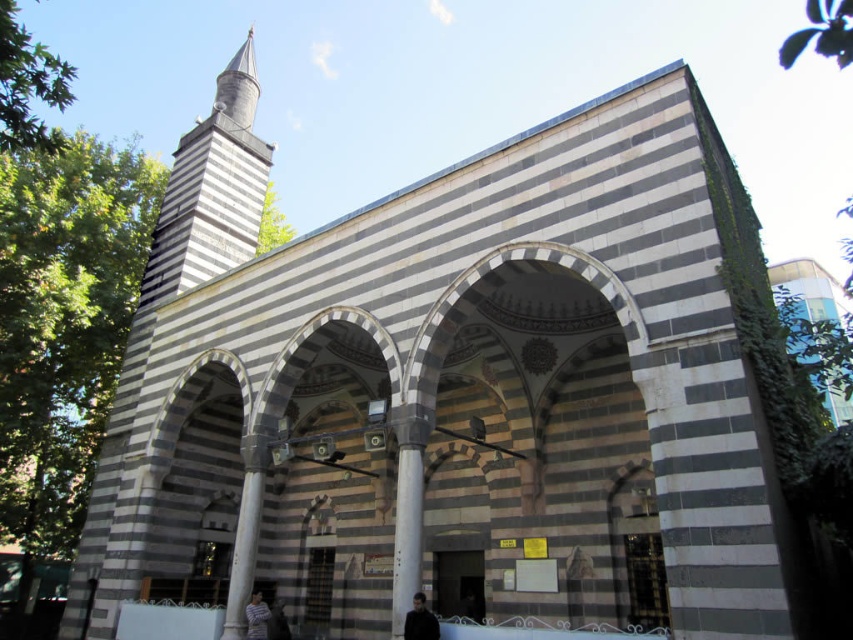
Does dark brown leather jacket at lower right appear under striped shirt at lower center?

No, dark brown leather jacket at lower right is not below striped shirt at lower center.

Is dark brown leather jacket at lower right bigger than striped shirt at lower center?

No, dark brown leather jacket at lower right is not bigger than striped shirt at lower center.

Is point (418, 596) in front of point (250, 621)?

That is True.

At what (x,y) coordinates should I click in order to perform the action: click on dark brown leather jacket at lower right. Please return your answer as a coordinate pair (x, y). Image resolution: width=853 pixels, height=640 pixels. Looking at the image, I should click on pyautogui.click(x=421, y=620).

What do you see at coordinates (212, 189) in the screenshot?
I see `gray stone minaret at upper left` at bounding box center [212, 189].

Does gray stone minaret at upper left have a smaller size compared to striped shirt at lower center?

No.

Who is more distant from viewer, (222, 256) or (253, 595)?

Point (222, 256)

Where is `gray stone minaret at upper left`? The width and height of the screenshot is (853, 640). gray stone minaret at upper left is located at coordinates (212, 189).

Is gray stone minaret at upper left wider than dark brown leather jacket at lower right?

Yes.

Measure the distance between gray stone minaret at upper left and camera.

A distance of 226.99 feet exists between gray stone minaret at upper left and camera.

Which is behind, point (152, 300) or point (436, 628)?

Positioned behind is point (152, 300).

I want to click on gray stone minaret at upper left, so click(x=212, y=189).